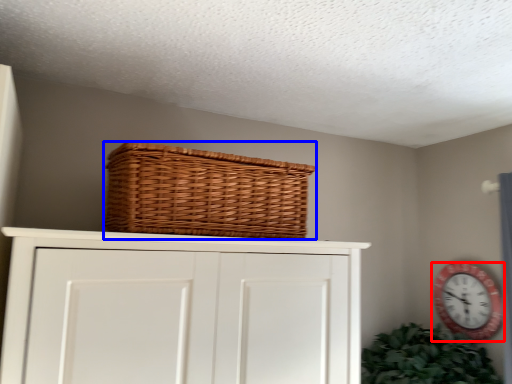
Question: Which object appears closest to the camera in this image, wall clock (highlighted by a red box) or basket (highlighted by a blue box)?

Choices:
 (A) wall clock
 (B) basket

Answer: (B)